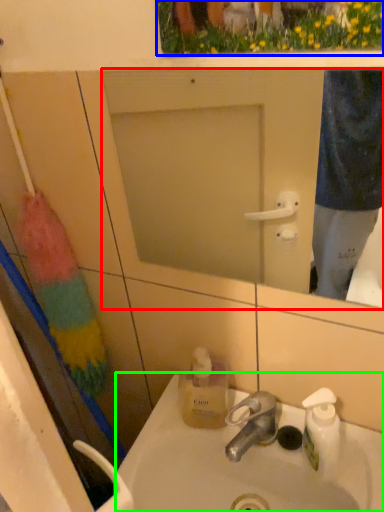
Question: Estimate the real-world distances between objects in this image. Which object is closer to mirror (highlighted by a red box), flower (highlighted by a blue box) or sink (highlighted by a green box)?

Choices:
 (A) flower
 (B) sink

Answer: (B)